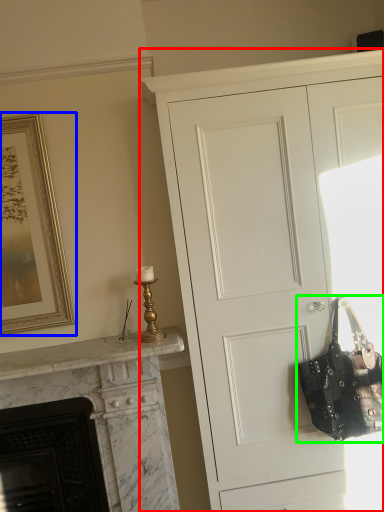
Question: Based on their relative distances, which object is farther from cupboard (highlighted by a red box)? Choose from picture frame (highlighted by a blue box) and handbag (highlighted by a green box).

Choices:
 (A) picture frame
 (B) handbag

Answer: (A)